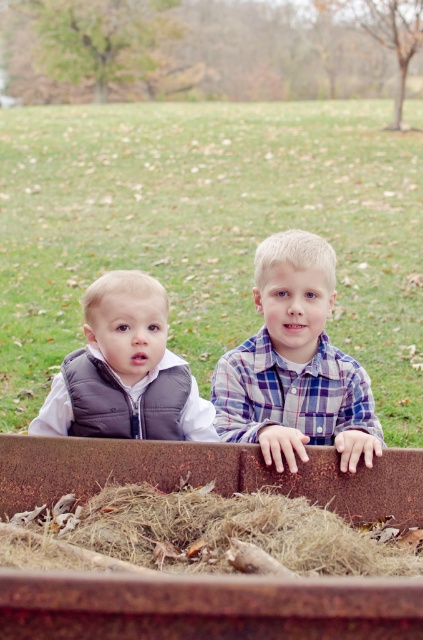
You are a parent standing near the children in the image and want to grab the brown dry hay at center to clean up. Can you reach it without moving your position?

The brown dry hay at center is 1.98 meters away from viewer, so you cannot reach it without moving closer.

You are a parent trying to locate your child who is sitting in the matte gray vest at left. You see the brown dry hay at center. Which direction should you move to find the child?

The matte gray vest at left is to the left of the brown dry hay at center, so you should move to the left of the brown dry hay at center to find the child.

You are a photographer trying to capture the boy in the blue plaid shirt at center. The camera is set to focus on the point at point (294,364). Will the boy in the blue plaid shirt at center be in focus?

The blue plaid shirt at center is located at point (294,364), so yes, the boy in the blue plaid shirt at center will be in focus since the camera is focused on that point.